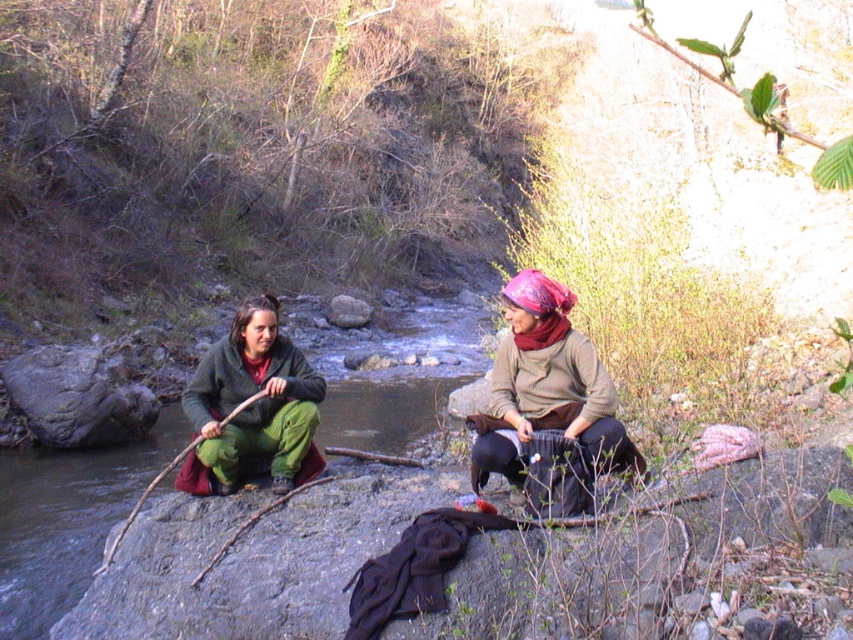
Question: Which point is closer to the camera?

Choices:
 (A) (521, 410)
 (B) (305, 404)

Answer: (A)

Question: Which point is farther from the camera taking this photo?

Choices:
 (A) (288, 406)
 (B) (483, 470)

Answer: (A)

Question: Is matte brown scarf at center smaller than green fuzzy pants at left?

Choices:
 (A) no
 (B) yes

Answer: (A)

Question: Can you confirm if matte brown scarf at center is positioned below green fuzzy pants at left?

Choices:
 (A) yes
 (B) no

Answer: (B)

Question: From the image, what is the correct spatial relationship of matte brown scarf at center in relation to green fuzzy pants at left?

Choices:
 (A) below
 (B) above

Answer: (B)

Question: Among these points, which one is nearest to the camera?

Choices:
 (A) (570, 376)
 (B) (287, 349)

Answer: (A)